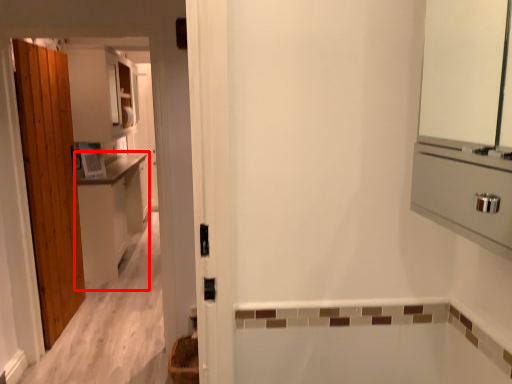
Question: From the image's perspective, where is cabinetry (annotated by the red box) located relative to basket?

Choices:
 (A) above
 (B) below

Answer: (A)